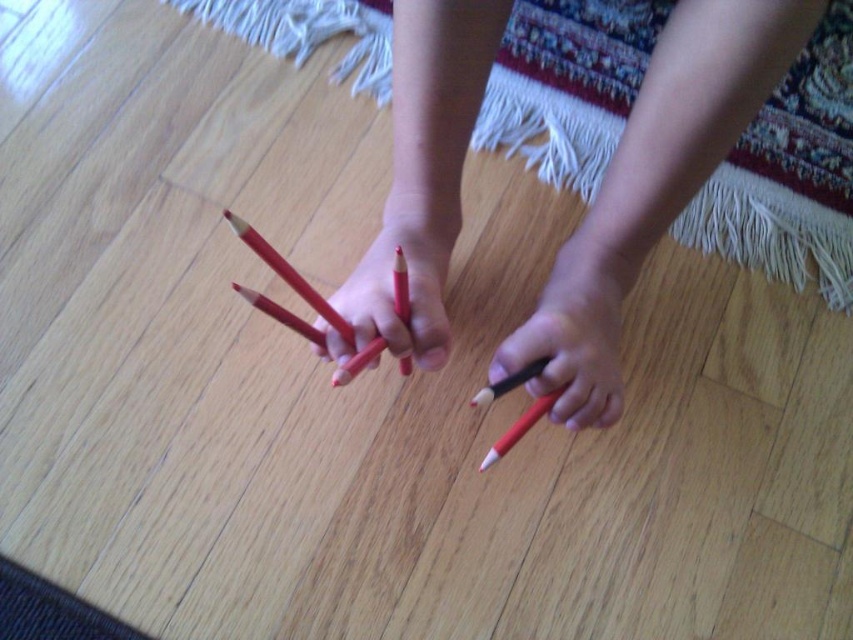
You are a teacher organizing art supplies. You have two pencils in front of you, the matte wood pencil at center and the matte black pencil at lower center. Which pencil should you choose if you need the larger one for a project?

The matte wood pencil at center is bigger than the matte black pencil at lower center, so you should choose the matte wood pencil at center.

You are a child trying to reach the matte wood pencil at center on the wooden floor. Your hand can extend 24 inches. Can you reach it?

The matte wood pencil at center is 27.60 inches away from you, which is beyond your hand extension of 24 inches. You cannot reach it.